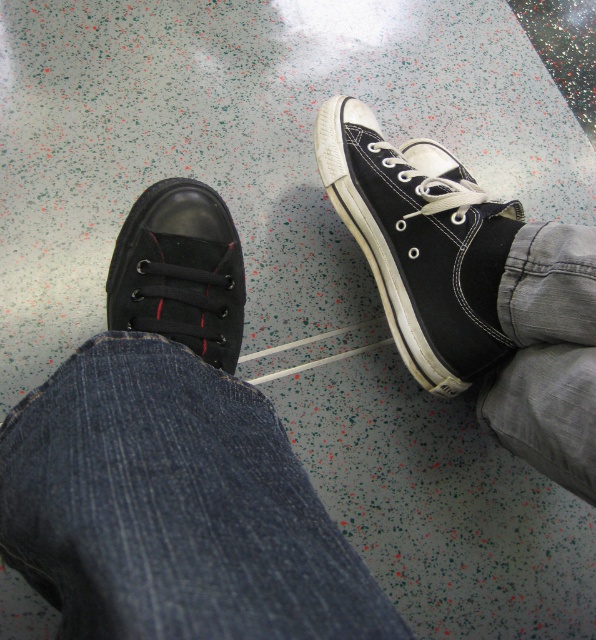
You are standing in a room with a speckled floor and see the matte canvas sneaker at upper center and the matte black shoe at lower left. Which shoe is closer to you?

The matte canvas sneaker at upper center is closer to you because the matte black shoe at lower left is behind it.

You are standing in a room with a speckled floor and see two shoes, the matte canvas sneaker at upper center and the matte black shoe at lower left. Which one is wider?

The matte canvas sneaker at upper center is wider than the matte black shoe at lower left.

You are standing in front of the speckled floor and want to place a small object between point A at point (x=414, y=184) and point B at point (x=179, y=280). Which point is closer to you so you can place the object near it?

Point B at point (x=179, y=280) is closer to you than point A at point (x=414, y=184), so you should place the object near point B.